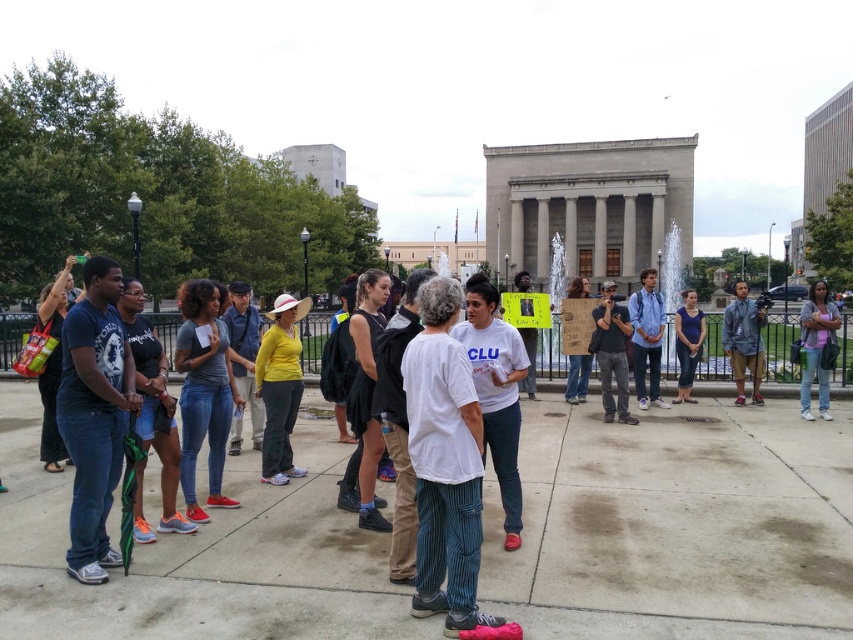
Question: Which point is farther from the camera taking this photo?

Choices:
 (A) (291, 474)
 (B) (610, 310)
 (C) (660, 352)

Answer: (C)

Question: Estimate the real-world distances between objects in this image. Which object is closer to the blue cotton shirt at center?

Choices:
 (A) denim jeans at right
 (B) blue denim jeans at center

Answer: (B)

Question: Is denim jacket at right below blue cotton shirt at center?

Choices:
 (A) no
 (B) yes

Answer: (A)

Question: Can you confirm if denim jacket at right is bigger than denim jeans at right?

Choices:
 (A) yes
 (B) no

Answer: (A)

Question: Based on their relative distances, which object is nearer to the concrete pavement at center?

Choices:
 (A) denim jacket at right
 (B) blue denim jeans at center
 (C) dark gray jeans at center
 (D) matte yellow shirt at center

Answer: (D)

Question: Can you confirm if dark gray jeans at center is positioned below blue denim jeans at center?

Choices:
 (A) no
 (B) yes

Answer: (B)